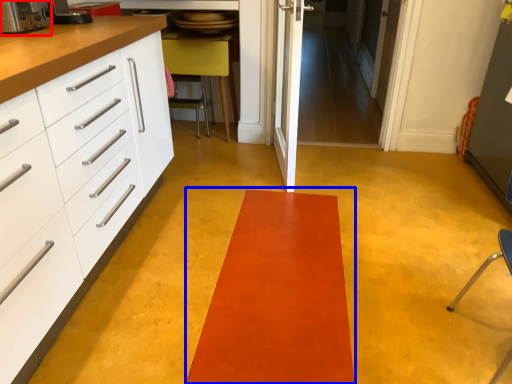
Question: Which point is further to the camera, appliance (highlighted by a red box) or mat (highlighted by a blue box)?

Choices:
 (A) appliance
 (B) mat

Answer: (A)